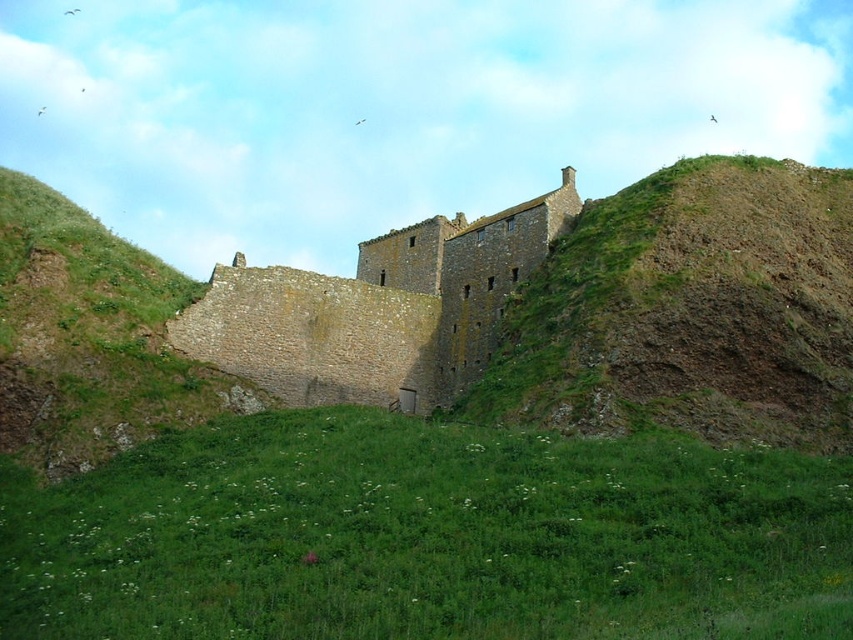
Does brown rocky hillside at upper right have a larger size compared to brown stone castle at center?

No.

Who is more forward, [680,381] or [245,356]?

Point [680,381]

Locate an element on the screen. This screenshot has height=640, width=853. brown rocky hillside at upper right is located at coordinates (689, 310).

Identify the location of brown rocky hillside at upper right. The image size is (853, 640). (689, 310).

Is green grassy field at center to the right of brown stone castle at center from the viewer's perspective?

Yes, green grassy field at center is to the right of brown stone castle at center.

Is point (532, 433) closer to viewer compared to point (169, 339)?

Yes, it is.

Who is more forward, (302, 600) or (316, 349)?

Point (302, 600) is in front.

Locate an element on the screen. This screenshot has height=640, width=853. green grassy field at center is located at coordinates (427, 536).

This screenshot has height=640, width=853. Describe the element at coordinates (427, 536) in the screenshot. I see `green grassy field at center` at that location.

Measure the distance between point (792, 532) and camera.

The distance of point (792, 532) from camera is 41.61 meters.

Identify the location of green grassy field at center. (427, 536).